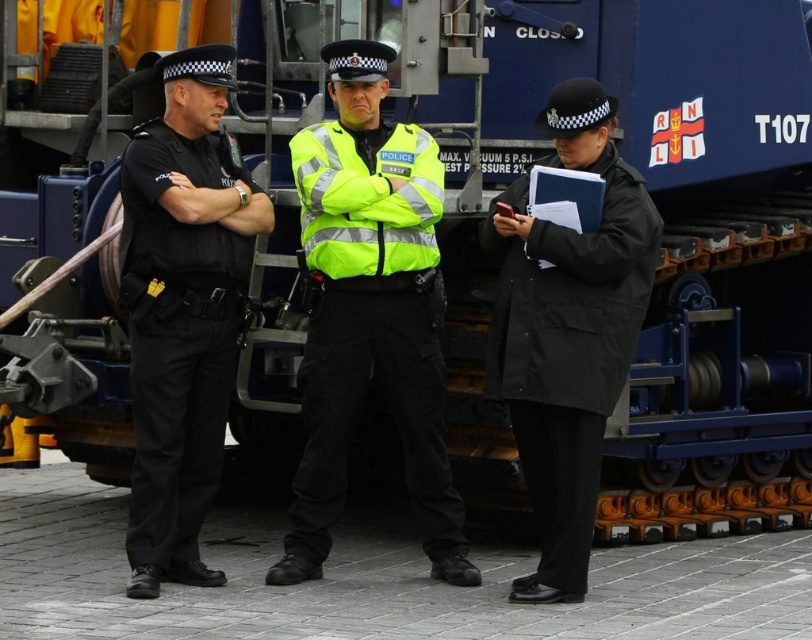
You are a photographer standing in front of the RNLI rescue vessel. You need to take a photo that includes both the point at coordinates point (346, 163) and point (201, 403). Which point should you focus on first to ensure both are in sharp focus?

You should focus on point (346, 163) first because it is closer to you than point (201, 403). This ensures the closer point is in focus, and the farther point will also be sharp due to depth of field.